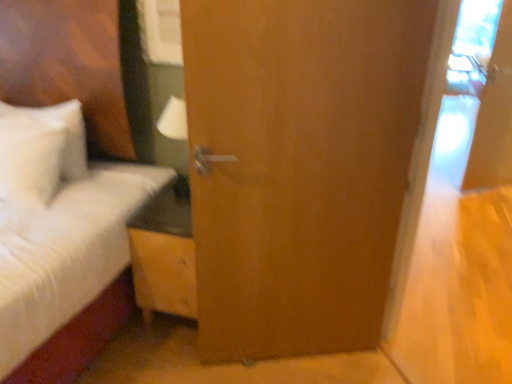
Question: Considering the relative sizes of wooden nightstand at center and wooden door at center in the image provided, is wooden nightstand at center taller than wooden door at center?

Choices:
 (A) no
 (B) yes

Answer: (A)

Question: From the image's perspective, is wooden nightstand at center on top of wooden door at center?

Choices:
 (A) no
 (B) yes

Answer: (A)

Question: Is wooden nightstand at center closer to the viewer compared to wooden door at center?

Choices:
 (A) yes
 (B) no

Answer: (B)

Question: Considering the relative sizes of wooden nightstand at center and wooden door at center in the image provided, is wooden nightstand at center thinner than wooden door at center?

Choices:
 (A) yes
 (B) no

Answer: (B)

Question: Can you confirm if wooden nightstand at center is bigger than wooden door at center?

Choices:
 (A) no
 (B) yes

Answer: (A)

Question: Is wooden nightstand at center taller or shorter than wooden door at center?

Choices:
 (A) short
 (B) tall

Answer: (A)

Question: In terms of width, does wooden nightstand at center look wider or thinner when compared to wooden door at center?

Choices:
 (A) wide
 (B) thin

Answer: (A)

Question: From a real-world perspective, relative to wooden door at center, is wooden nightstand at center vertically above or below?

Choices:
 (A) below
 (B) above

Answer: (A)

Question: Visually, is wooden nightstand at center positioned to the left or to the right of wooden door at center?

Choices:
 (A) left
 (B) right

Answer: (A)

Question: From a real-world perspective, is wooden nightstand at center above or below white fluffy bed at left?

Choices:
 (A) above
 (B) below

Answer: (B)

Question: Considering the positions of point (189, 211) and point (66, 261), is point (189, 211) closer or farther from the camera than point (66, 261)?

Choices:
 (A) closer
 (B) farther

Answer: (B)

Question: Considering the positions of wooden nightstand at center and white fluffy bed at left in the image, is wooden nightstand at center wider or thinner than white fluffy bed at left?

Choices:
 (A) thin
 (B) wide

Answer: (A)

Question: Considering the positions of wooden nightstand at center and white fluffy bed at left in the image, is wooden nightstand at center bigger or smaller than white fluffy bed at left?

Choices:
 (A) big
 (B) small

Answer: (B)

Question: Is white fluffy bed at left bigger or smaller than wooden door at center?

Choices:
 (A) big
 (B) small

Answer: (A)

Question: In terms of height, does white fluffy bed at left look taller or shorter compared to wooden door at center?

Choices:
 (A) short
 (B) tall

Answer: (A)